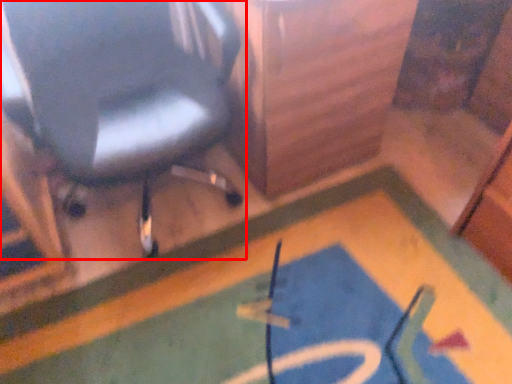
Question: From the image's perspective, considering the relative positions of chair (annotated by the red box) and bath mat in the image provided, where is chair (annotated by the red box) located with respect to the staircase?

Choices:
 (A) above
 (B) below

Answer: (A)